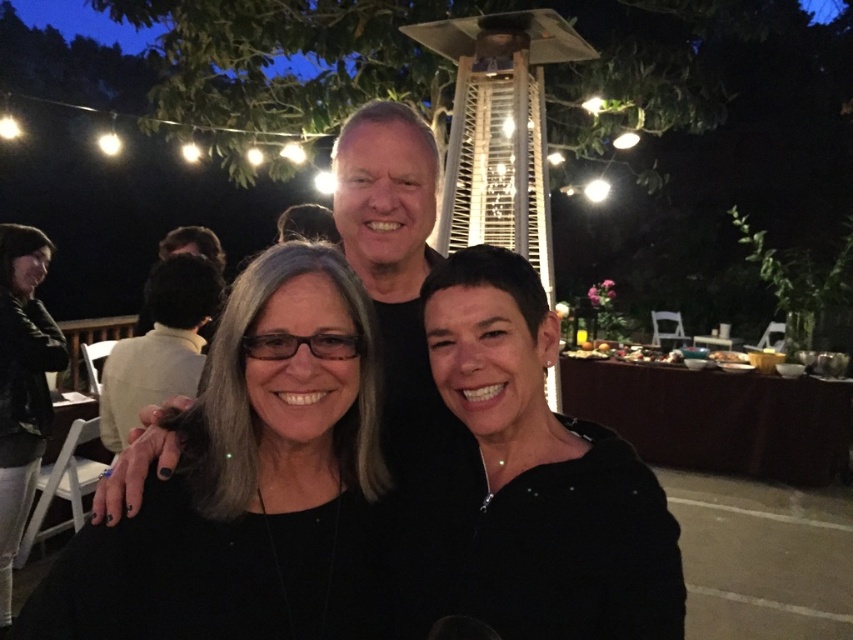
You are at a party and want to grab a drink. You see the black matte glasses at center and the black leather jacket at lower left. Which object is shorter?

The black matte glasses at center is not as tall as the black leather jacket at lower left, so the black matte glasses at center is shorter.